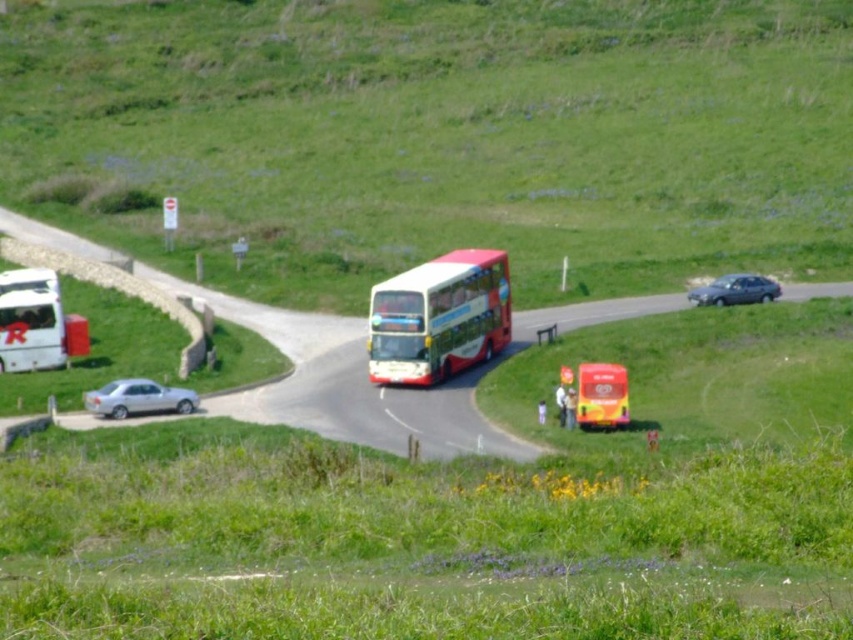
This screenshot has width=853, height=640. I want to click on white matte van at left, so click(30, 321).

Which is behind, point (3, 300) or point (160, 396)?

The point (3, 300) is behind.

The height and width of the screenshot is (640, 853). What are the coordinates of `white matte van at left` in the screenshot? It's located at (30, 321).

Does shiny red bus at center appear on the left side of metallic gray sedan at right?

Indeed, shiny red bus at center is positioned on the left side of metallic gray sedan at right.

Between shiny red bus at center and metallic gray sedan at right, which one appears on the right side from the viewer's perspective?

metallic gray sedan at right is more to the right.

Is point (590, 371) more distant than point (747, 298)?

No, it is not.

Identify the location of shiny red bus at center. This screenshot has height=640, width=853. (x=601, y=394).

Can you confirm if white glossy bus at center is smaller than metallic gray sedan at right?

Incorrect, white glossy bus at center is not smaller in size than metallic gray sedan at right.

Does white glossy bus at center have a lesser height compared to metallic gray sedan at right?

No, white glossy bus at center is not shorter than metallic gray sedan at right.

Image resolution: width=853 pixels, height=640 pixels. I want to click on white glossy bus at center, so click(439, 317).